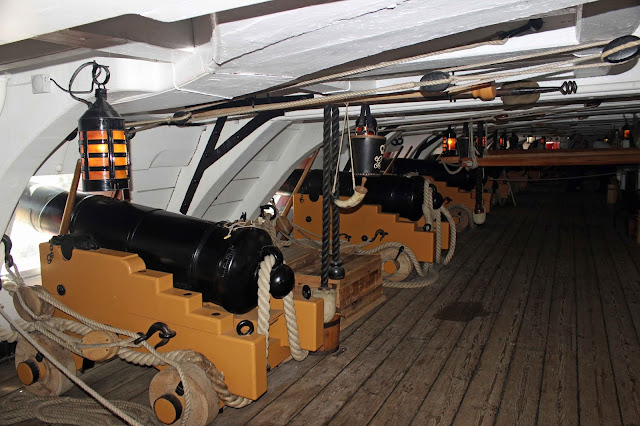
What are the coordinates of `wood floor` in the screenshot? It's located at (552, 313).